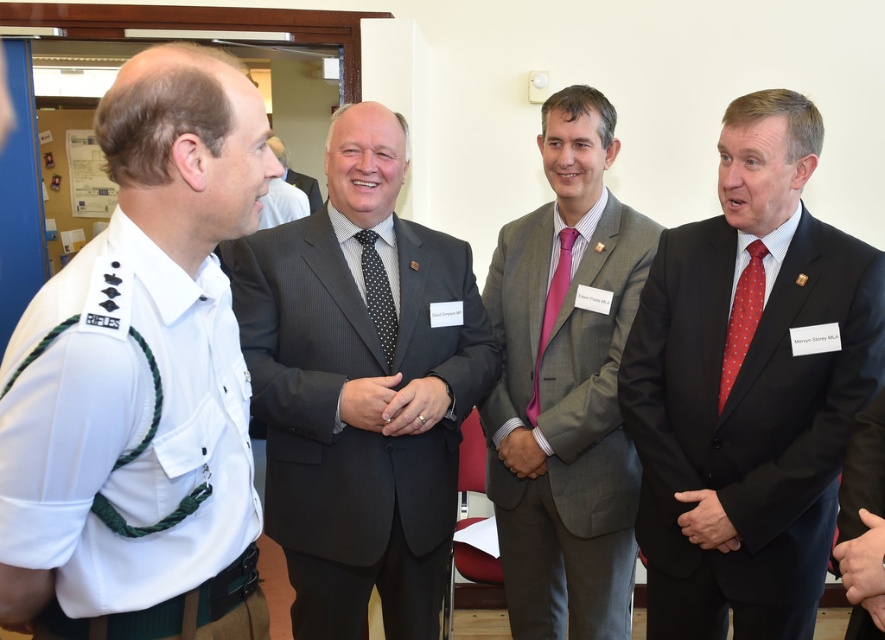
Who is positioned more to the left, black leather hand at center or black silk hand at center?

black silk hand at center

Which is in front, point (678, 516) or point (367, 401)?

Point (367, 401) is more forward.

The width and height of the screenshot is (885, 640). I want to click on black leather hand at center, so click(x=706, y=522).

Does point (802, 467) come farther from viewer compared to point (753, 316)?

That is False.

Where is `black wool suit at right`? This screenshot has width=885, height=640. black wool suit at right is located at coordinates (745, 420).

Who is higher up, gray textured suit at center or green fabric hand at lower left?

gray textured suit at center is higher up.

Is the position of gray textured suit at center less distant than that of green fabric hand at lower left?

No, it is not.

Is point (562, 609) more distant than point (1, 612)?

That is True.

Locate an element on the screen. This screenshot has height=640, width=885. gray textured suit at center is located at coordinates (566, 416).